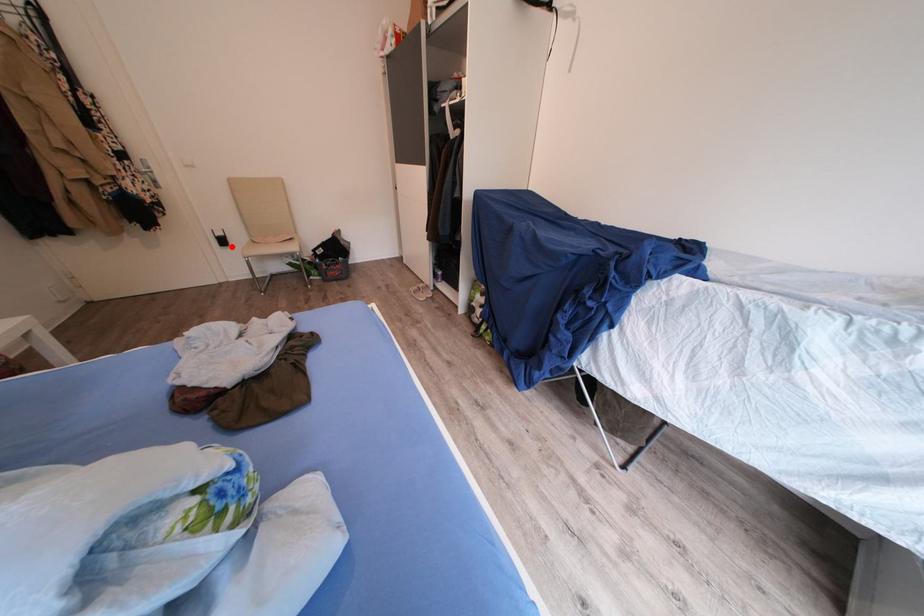
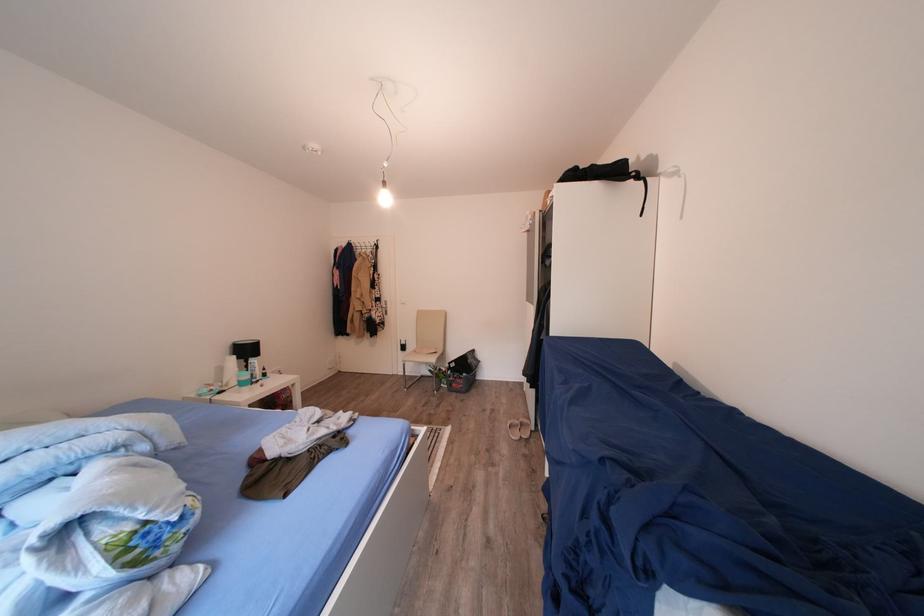
Question: I am providing you with two images of the same scene from different viewpoints. A red point is marked on the first image. At the location where the point appears in image 1, is it still visible in image 2?

Choices:
 (A) Yes
 (B) No

Answer: (A)